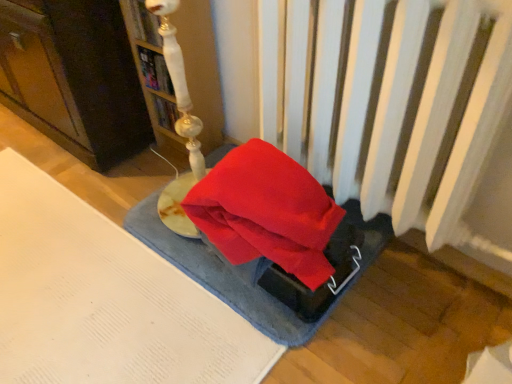
Question: From a real-world perspective, is blue textured yoga mat at center positioned over white glossy lamp at upper left, acting as the 2th book starting from the bottom, based on gravity?

Choices:
 (A) yes
 (B) no

Answer: (B)

Question: Could you tell me if blue textured yoga mat at center is turned towards white glossy lamp at upper left, acting as the 2th book starting from the bottom?

Choices:
 (A) yes
 (B) no

Answer: (B)

Question: Considering the relative sizes of blue textured yoga mat at center and white glossy lamp at upper left, the 1th book when ordered from top to bottom, in the image provided, is blue textured yoga mat at center smaller than white glossy lamp at upper left, the 1th book when ordered from top to bottom,?

Choices:
 (A) yes
 (B) no

Answer: (B)

Question: From the image's perspective, is blue textured yoga mat at center located above white glossy lamp at upper left, the 1th book when ordered from top to bottom?

Choices:
 (A) no
 (B) yes

Answer: (A)

Question: Does blue textured yoga mat at center have a greater width compared to white glossy lamp at upper left, acting as the 2th book starting from the bottom?

Choices:
 (A) yes
 (B) no

Answer: (A)

Question: Is blue textured yoga mat at center not inside white glossy lamp at upper left, the 1th book when ordered from top to bottom?

Choices:
 (A) yes
 (B) no

Answer: (A)

Question: Is hardcover book at upper center, positioned as the 2th book in top-to-bottom order, a part of white glossy lamp at upper left, the 1th book when ordered from top to bottom?

Choices:
 (A) yes
 (B) no

Answer: (B)

Question: Can you confirm if white glossy lamp at upper left, acting as the 2th book starting from the bottom, is taller than hardcover book at upper center, positioned as the 2th book in top-to-bottom order?

Choices:
 (A) yes
 (B) no

Answer: (A)

Question: Is the position of white glossy lamp at upper left, acting as the 2th book starting from the bottom, less distant than that of hardcover book at upper center, positioned as the 2th book in top-to-bottom order?

Choices:
 (A) yes
 (B) no

Answer: (A)

Question: Considering the relative sizes of white glossy lamp at upper left, the 1th book when ordered from top to bottom, and hardcover book at upper center, positioned as the 2th book in top-to-bottom order, in the image provided, is white glossy lamp at upper left, the 1th book when ordered from top to bottom, bigger than hardcover book at upper center, positioned as the 2th book in top-to-bottom order,?

Choices:
 (A) no
 (B) yes

Answer: (B)

Question: Is white glossy lamp at upper left, acting as the 2th book starting from the bottom, to the right of hardcover book at upper center, positioned as the 2th book in top-to-bottom order, from the viewer's perspective?

Choices:
 (A) yes
 (B) no

Answer: (B)

Question: From the image's perspective, is white glossy lamp at upper left, the 1th book when ordered from top to bottom, on top of hardcover book at upper center, the 1th book positioned from the bottom?

Choices:
 (A) yes
 (B) no

Answer: (A)

Question: Does blue textured yoga mat at center turn towards matte white lamp at upper left?

Choices:
 (A) no
 (B) yes

Answer: (A)